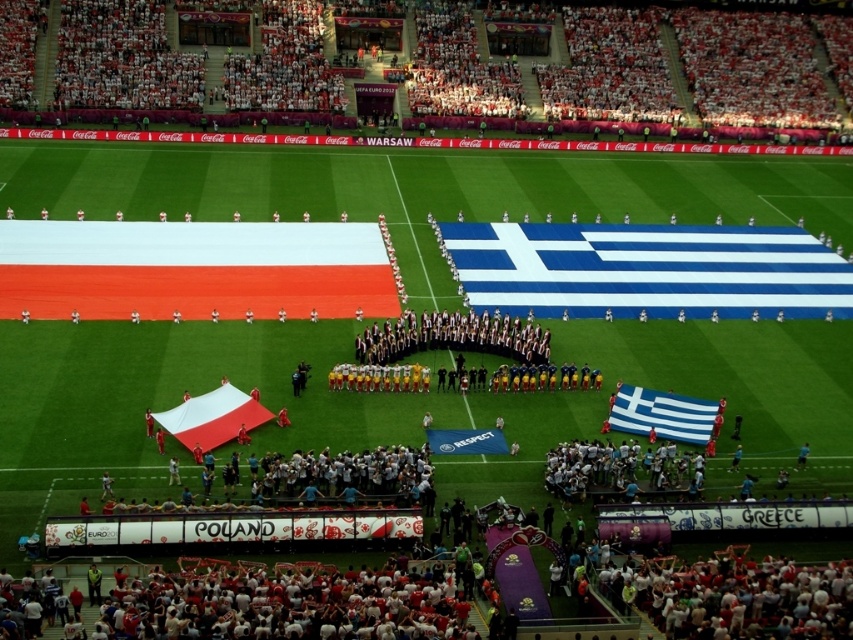
Question: Which object appears closest to the camera in this image?

Choices:
 (A) blue and white fabric flag at lower right
 (B) white matte flag at center

Answer: (B)

Question: Is blue and white fabric flag at lower right further to the viewer compared to white matte flag at center?

Choices:
 (A) no
 (B) yes

Answer: (B)

Question: Which object is closer to the camera taking this photo?

Choices:
 (A) blue and white fabric flag at lower right
 (B) white matte flag at center

Answer: (B)

Question: Can you confirm if blue and white fabric flag at lower right is smaller than white matte flag at center?

Choices:
 (A) no
 (B) yes

Answer: (B)

Question: In this image, where is blue and white fabric flag at lower right located relative to white matte flag at center?

Choices:
 (A) left
 (B) right

Answer: (B)